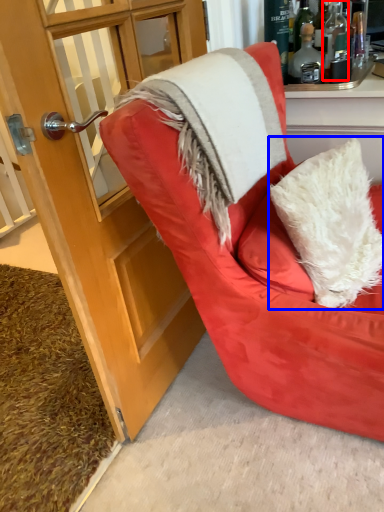
Question: Which of the following is the farthest to the observer, bottle (highlighted by a red box) or pillow (highlighted by a blue box)?

Choices:
 (A) bottle
 (B) pillow

Answer: (A)